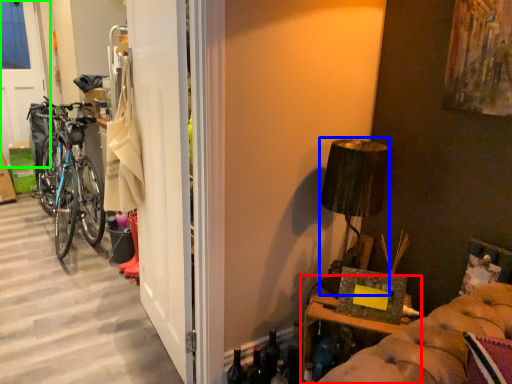
Question: Considering the real-world distances, which object is farthest from furniture (highlighted by a red box)? lamp (highlighted by a blue box) or screen door (highlighted by a green box)?

Choices:
 (A) lamp
 (B) screen door

Answer: (B)